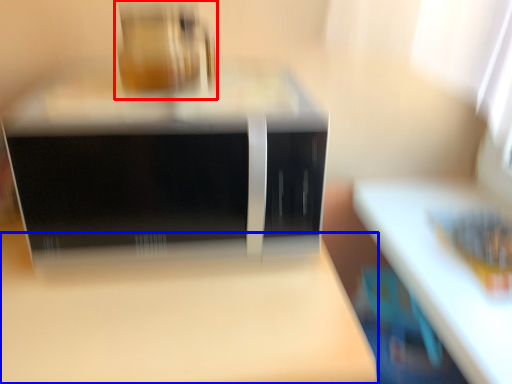
Question: Which object is further to the camera taking this photo, appliance (highlighted by a red box) or table (highlighted by a blue box)?

Choices:
 (A) appliance
 (B) table

Answer: (A)